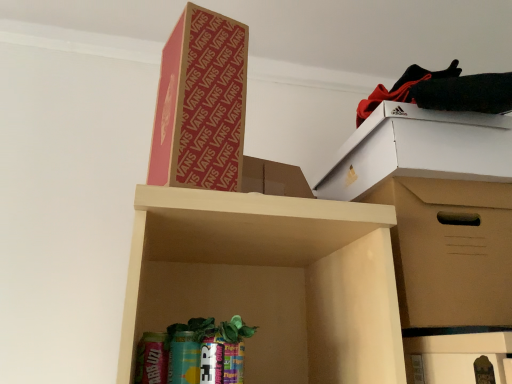
Question: Considering the relative sizes of cardboard box at upper center, the second cardboard box when ordered from right to left, and black fabric at upper right in the image provided, is cardboard box at upper center, the second cardboard box when ordered from right to left, taller than black fabric at upper right?

Choices:
 (A) no
 (B) yes

Answer: (B)

Question: Can you confirm if cardboard box at upper center, positioned as the 1th cardboard box in top-to-bottom order, is shorter than black fabric at upper right?

Choices:
 (A) no
 (B) yes

Answer: (A)

Question: From the image's perspective, is cardboard box at upper center, the second cardboard box when ordered from right to left, beneath black fabric at upper right?

Choices:
 (A) yes
 (B) no

Answer: (A)

Question: Considering the relative positions of cardboard box at upper center, the second cardboard box when ordered from right to left, and black fabric at upper right in the image provided, is cardboard box at upper center, the second cardboard box when ordered from right to left, behind black fabric at upper right?

Choices:
 (A) yes
 (B) no

Answer: (B)

Question: Is cardboard box at upper center, positioned as the 1th cardboard box in top-to-bottom order, positioned in front of black fabric at upper right?

Choices:
 (A) yes
 (B) no

Answer: (A)

Question: Is point (187, 77) positioned closer to the camera than point (480, 109)?

Choices:
 (A) closer
 (B) farther

Answer: (A)

Question: In the image, is cardboard box at upper center, which is the 2th cardboard box in bottom-to-top order, on the left side or the right side of black fabric at upper right?

Choices:
 (A) right
 (B) left

Answer: (B)

Question: Considering the positions of cardboard box at upper center, positioned as the 1th cardboard box in top-to-bottom order, and black fabric at upper right in the image, is cardboard box at upper center, positioned as the 1th cardboard box in top-to-bottom order, bigger or smaller than black fabric at upper right?

Choices:
 (A) big
 (B) small

Answer: (A)

Question: From a real-world perspective, is cardboard box at upper center, positioned as the 1th cardboard box in top-to-bottom order, physically located above or below black fabric at upper right?

Choices:
 (A) above
 (B) below

Answer: (B)

Question: In terms of width, does brown cardboard box at right, arranged as the first cardboard box when viewed from the right, look wider or thinner when compared to black fabric at upper right?

Choices:
 (A) wide
 (B) thin

Answer: (A)

Question: Is brown cardboard box at right, arranged as the first cardboard box when viewed from the right, in front of or behind black fabric at upper right in the image?

Choices:
 (A) front
 (B) behind

Answer: (A)

Question: Is brown cardboard box at right, marked as the 2th cardboard box in a top-to-bottom arrangement, taller or shorter than black fabric at upper right?

Choices:
 (A) tall
 (B) short

Answer: (A)

Question: From the image's perspective, is brown cardboard box at right, the 2th cardboard box in the left-to-right sequence, located above or below black fabric at upper right?

Choices:
 (A) above
 (B) below

Answer: (B)

Question: From a real-world perspective, relative to brown cardboard box at right, the 2th cardboard box in the left-to-right sequence, is cardboard box at upper center, the second cardboard box when ordered from right to left, vertically above or below?

Choices:
 (A) below
 (B) above

Answer: (B)

Question: Is cardboard box at upper center, positioned as the 1th cardboard box in top-to-bottom order, taller or shorter than brown cardboard box at right, the 2th cardboard box in the left-to-right sequence?

Choices:
 (A) short
 (B) tall

Answer: (B)